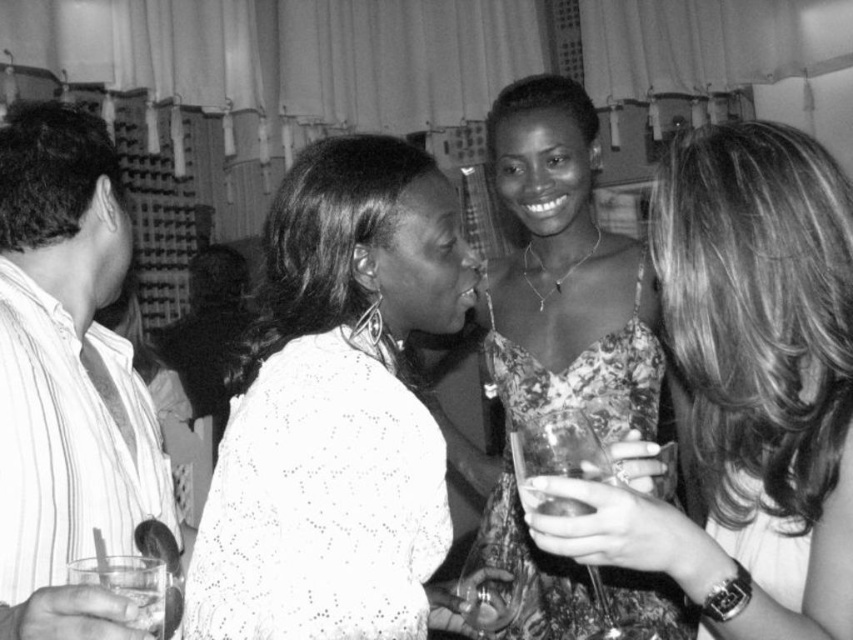
Who is higher up, floral dress at center or transparent plastic cup at center?

floral dress at center is higher up.

Can you confirm if floral dress at center is smaller than transparent plastic cup at center?

Incorrect, floral dress at center is not smaller in size than transparent plastic cup at center.

Where is `floral dress at center`? This screenshot has width=853, height=640. floral dress at center is located at coordinates (746, 388).

Between point (573, 451) and point (518, 486), which one is positioned in front?

Positioned in front is point (518, 486).

Does point (601, 637) lie behind point (577, 477)?

Yes.

I want to click on transparent plastic cup at center, so click(556, 458).

Which of these two, printed fabric dress at center or clear glass at lower left, stands taller?

printed fabric dress at center

Is printed fabric dress at center in front of clear glass at lower left?

No, printed fabric dress at center is behind clear glass at lower left.

Does point (537, 129) lie in front of point (113, 561)?

No, (537, 129) is further to viewer.

I want to click on printed fabric dress at center, so click(x=566, y=273).